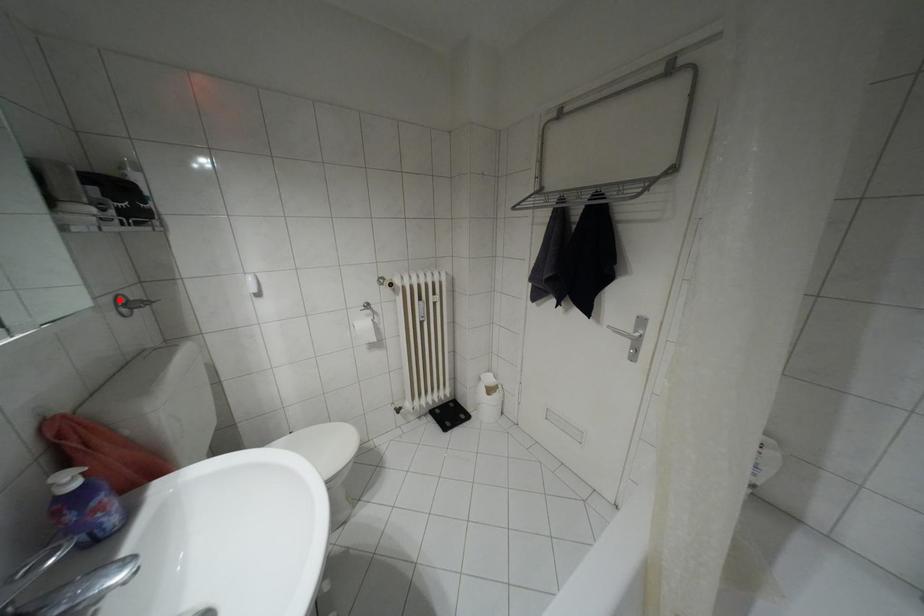
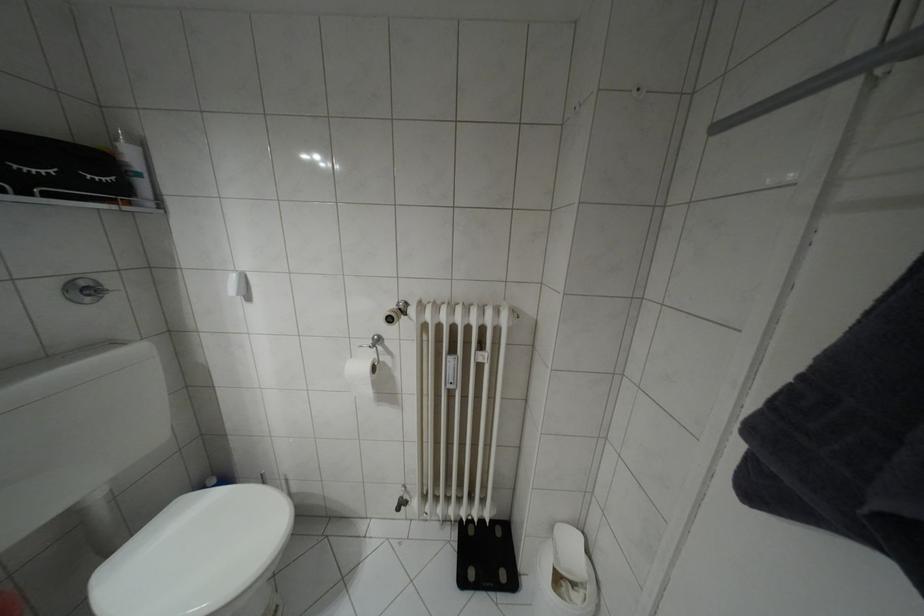
Find the pixel in the second image that matches the highlighted location in the first image.

(81, 284)